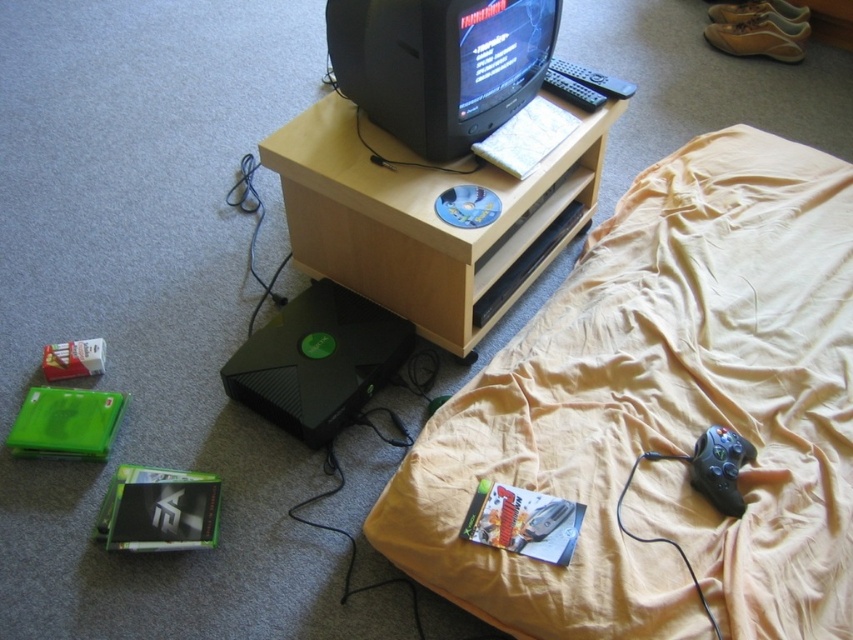
You are trying to place the black plastic remote at upper center on top of the wooden table at center. Will it fit without falling off?

The wooden table at center has a greater height compared to black plastic remote at upper center, so the remote will fit on the table without falling off since the table is taller than the remote.

You are a guest in this room and want to sit on the wooden table at center to rest. However, you are 1.8 meters tall. Will your head bump into the beige fabric bed at upper right?

The beige fabric bed at upper right is much taller than the wooden table at center. Since the bed is taller, it might be positioned above or behind the table, so your head might not bump into it while sitting on the table.

You are a guest in this room and want to grab the remote to change the channel. The beige fabric bed at upper right is in your way. Can you move around it to reach the black plastic remote at upper center?

The beige fabric bed at upper right is below the black plastic remote at upper center, so you can move around the bed to reach the remote since it is positioned lower.